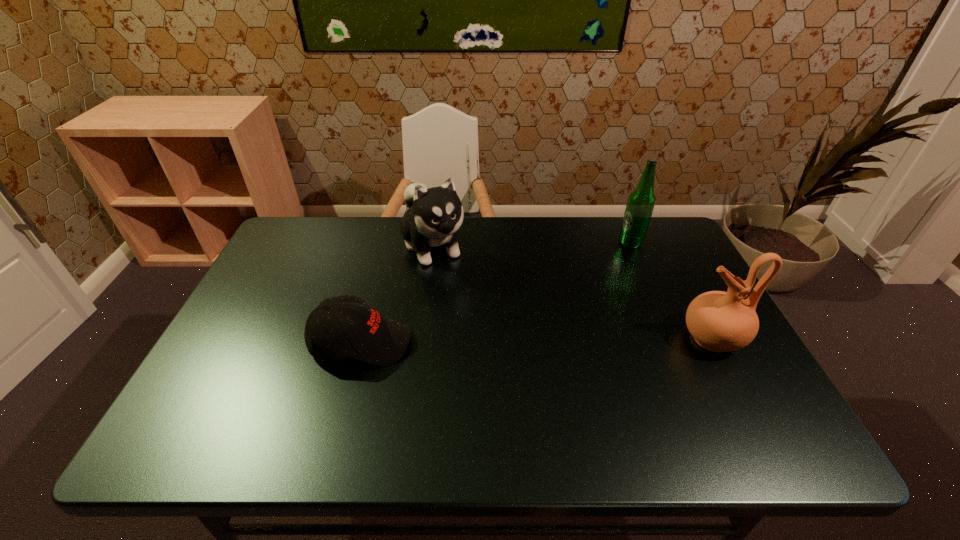
I want to click on free region located on the label of the beer bottle, so click(x=587, y=311).

You are a GUI agent. You are given a task and a screenshot of the screen. Output one action in this format:
    pyautogui.click(x=<x>, y=<y>)
    Task: Click on the free space located at the face of the puppy
    
    Given the screenshot: What is the action you would take?
    pyautogui.click(x=504, y=382)

Where is `blank area located 0.300m at the face of the puppy`? Image resolution: width=960 pixels, height=540 pixels. blank area located 0.300m at the face of the puppy is located at coordinates (486, 350).

Identify the location of free location located at the face of the puppy. This screenshot has width=960, height=540. (455, 295).

The image size is (960, 540). What are the coordinates of `beer bottle present at the far edge` in the screenshot? It's located at (641, 201).

This screenshot has width=960, height=540. I want to click on puppy that is positioned at the far edge, so click(x=434, y=217).

Locate an element on the screen. The height and width of the screenshot is (540, 960). pottery present at the right edge is located at coordinates (719, 321).

Locate an element on the screen. This screenshot has width=960, height=540. beer bottle positioned at the right edge is located at coordinates (641, 201).

The height and width of the screenshot is (540, 960). In order to click on object present at the far right corner in this screenshot , I will do `click(641, 201)`.

This screenshot has height=540, width=960. I want to click on free space at the far edge, so click(365, 248).